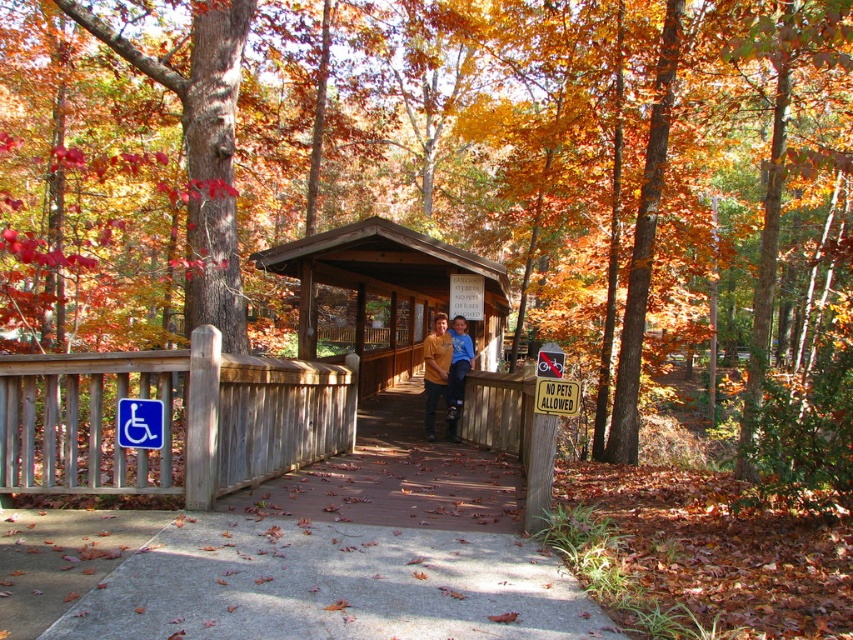
Question: Is brown wooden bridge at center above metallic rectangular sign at center?

Choices:
 (A) no
 (B) yes

Answer: (A)

Question: Can you confirm if wooden gazebo at center is positioned above matte yellow shirt at center?

Choices:
 (A) yes
 (B) no

Answer: (A)

Question: Which of the following is the closest to the observer?

Choices:
 (A) (315, 600)
 (B) (453, 371)
 (C) (125, 397)
 (D) (461, 339)

Answer: (A)

Question: Among these objects, which one is farthest from the camera?

Choices:
 (A) wooden gazebo at center
 (B) blue plastic wheelchair symbol at center
 (C) matte yellow shirt at center
 (D) brown wooden bridge at center

Answer: (A)

Question: Which object appears closest to the camera in this image?

Choices:
 (A) brown wooden bridge at center
 (B) wooden gazebo at center
 (C) blue cotton shirt at center

Answer: (A)

Question: Is brown wooden bridge at center wider than metallic rectangular sign at center?

Choices:
 (A) no
 (B) yes

Answer: (B)